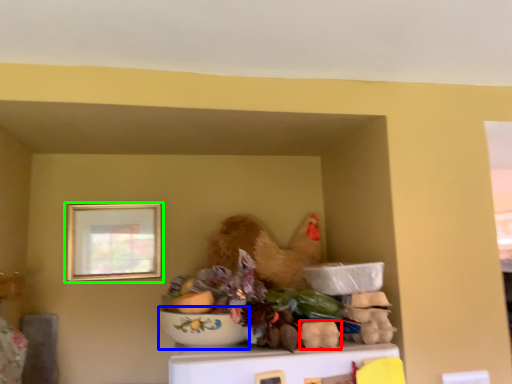
Question: Based on their relative distances, which object is nearer to food (highlighted by a red box)? Choose from bowl (highlighted by a blue box) and picture frame (highlighted by a green box).

Choices:
 (A) bowl
 (B) picture frame

Answer: (A)